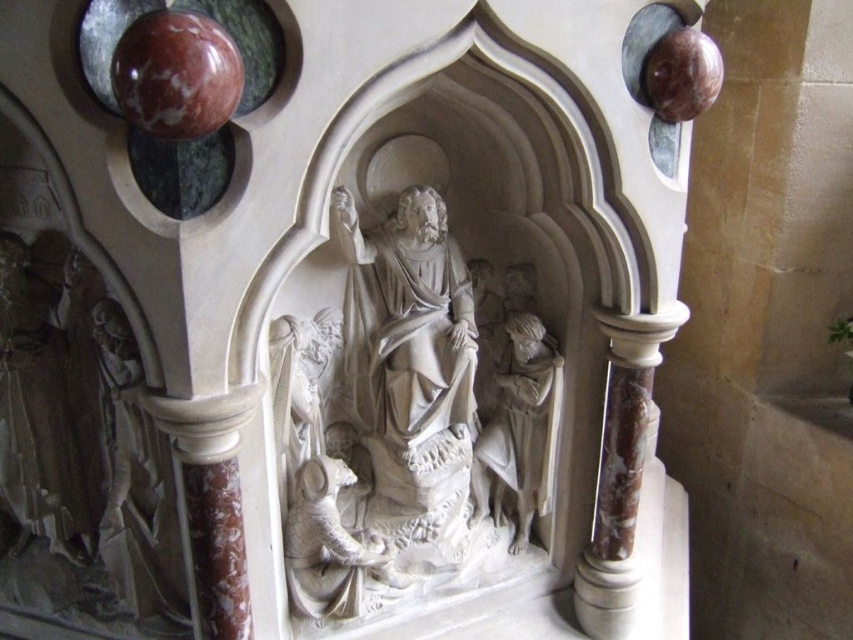
Is white marble sculpture at center thinner than white marble statue at center?

In fact, white marble sculpture at center might be wider than white marble statue at center.

Is white marble sculpture at center positioned at the back of white marble statue at center?

No, it is not.

What do you see at coordinates (409, 420) in the screenshot? I see `white marble sculpture at center` at bounding box center [409, 420].

Where is `white marble sculpture at center`? This screenshot has width=853, height=640. white marble sculpture at center is located at coordinates click(x=409, y=420).